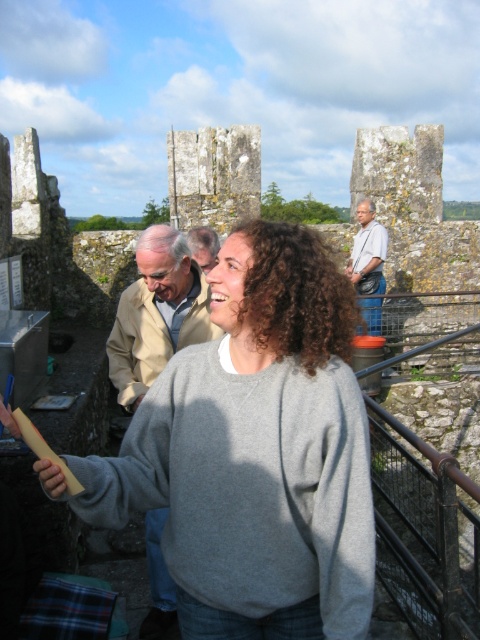
Between gray cotton sweater at center and light brown leather jacket at upper right, which one has less height?

Standing shorter between the two is light brown leather jacket at upper right.

The width and height of the screenshot is (480, 640). What do you see at coordinates (255, 452) in the screenshot?
I see `gray cotton sweater at center` at bounding box center [255, 452].

Which is in front, point (350, 397) or point (364, 211)?

Point (350, 397) is in front.

What are the coordinates of `gray cotton sweater at center` in the screenshot? It's located at (255, 452).

Who is more forward, (352, 548) or (202, 260)?

Point (352, 548) is in front.

Who is more distant from viewer, (304, 634) or (204, 260)?

The point (204, 260) is more distant.

Is point (205, 596) less distant than point (197, 250)?

Yes, it is.

Image resolution: width=480 pixels, height=640 pixels. I want to click on gray cotton sweater at center, so click(x=255, y=452).

Does light beige jacket at center appear under gray wool sweater at center?

Yes.

Measure the distance between light beige jacket at center and camera.

light beige jacket at center and camera are 76.02 feet apart from each other.

Looking at this image, who is more distant from viewer, (168,621) or (204,266)?

Positioned behind is point (204,266).

The width and height of the screenshot is (480, 640). What are the coordinates of `light beige jacket at center` in the screenshot? It's located at (156, 312).